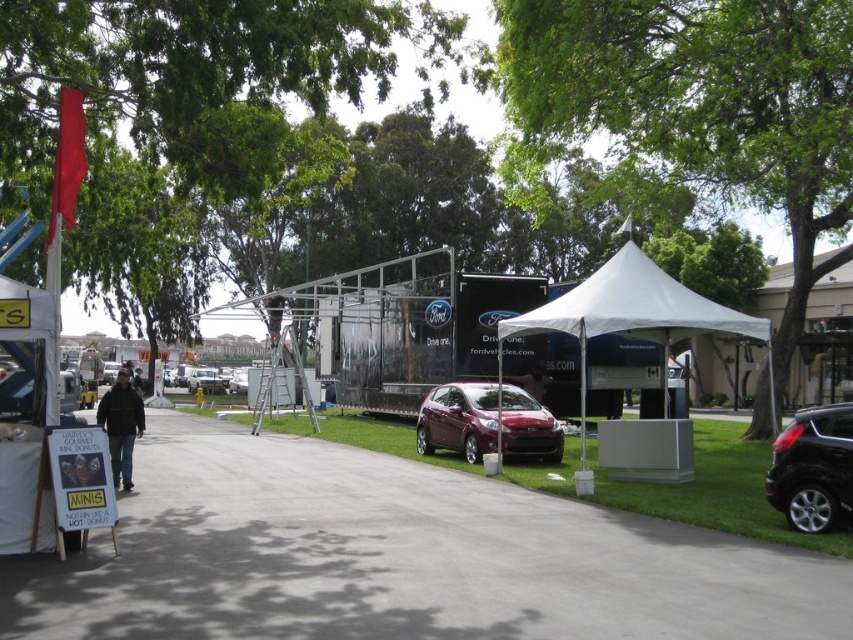
Is point (633, 304) farther from viewer compared to point (140, 380)?

No.

Who is shorter, white fabric tent at center or dark gray jacket at left?

Standing shorter between the two is dark gray jacket at left.

Which is in front, point (570, 330) or point (134, 374)?

Point (570, 330)

This screenshot has width=853, height=640. I want to click on white fabric tent at center, so click(x=633, y=321).

Can you confirm if shiny black suv at right is shorter than dark brown jacket at center?

Correct, shiny black suv at right is not as tall as dark brown jacket at center.

Is shiny black suv at right closer to camera compared to dark brown jacket at center?

No.

Does point (827, 456) come behind point (128, 390)?

No, it is not.

The width and height of the screenshot is (853, 640). Identify the location of shiny black suv at right. pos(813,468).

Who is positioned more to the right, white fabric canopy at center or shiny black suv at right?

From the viewer's perspective, white fabric canopy at center appears more on the right side.

Can you confirm if white fabric canopy at center is positioned to the left of shiny black suv at right?

Incorrect, white fabric canopy at center is not on the left side of shiny black suv at right.

Does point (703, 326) come in front of point (827, 522)?

That is False.

The image size is (853, 640). What are the coordinates of `white fabric canopy at center` in the screenshot? It's located at (634, 307).